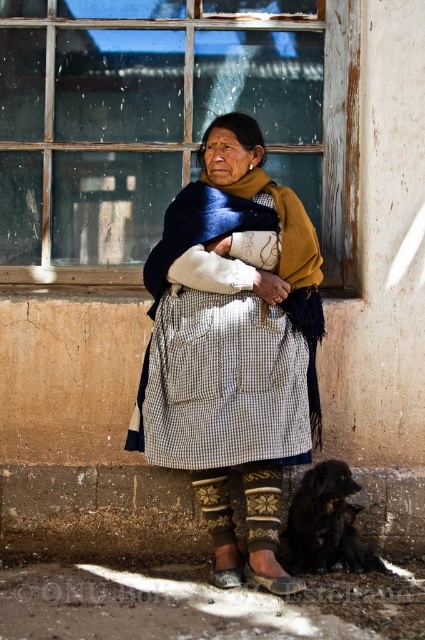
Is point (16, 205) behind point (249, 563)?

Yes, it is behind point (249, 563).

Which is in front, point (323, 42) or point (285, 589)?

Point (285, 589) is more forward.

Measure the distance between clear glass window at upper center and camera.

clear glass window at upper center is 4.40 meters away from camera.

You are a GUI agent. You are given a task and a screenshot of the screen. Output one action in this format:
    pyautogui.click(x=<x>, y=<y>)
    Task: Click on the clear glass window at upper center
    The image size is (425, 640).
    Given the screenshot: What is the action you would take?
    pyautogui.click(x=178, y=116)

Is point (255, 60) positioned in front of point (334, 564)?

No, it is behind (334, 564).

Which is more to the right, clear glass window at upper center or black fur dog at lower right?

From the viewer's perspective, black fur dog at lower right appears more on the right side.

From the picture: Measure the distance between clear glass window at upper center and camera.

clear glass window at upper center and camera are 4.40 meters apart from each other.

The height and width of the screenshot is (640, 425). What are the coordinates of `clear glass window at upper center` in the screenshot? It's located at (178, 116).

Is point (25, 129) less distant than point (221, 164)?

No.

Who is shorter, clear glass window at upper center or checkered fabric skirt at center?

clear glass window at upper center is shorter.

Locate an element on the screen. The width and height of the screenshot is (425, 640). clear glass window at upper center is located at coordinates (178, 116).

Where is `clear glass window at upper center`? This screenshot has height=640, width=425. clear glass window at upper center is located at coordinates (178, 116).